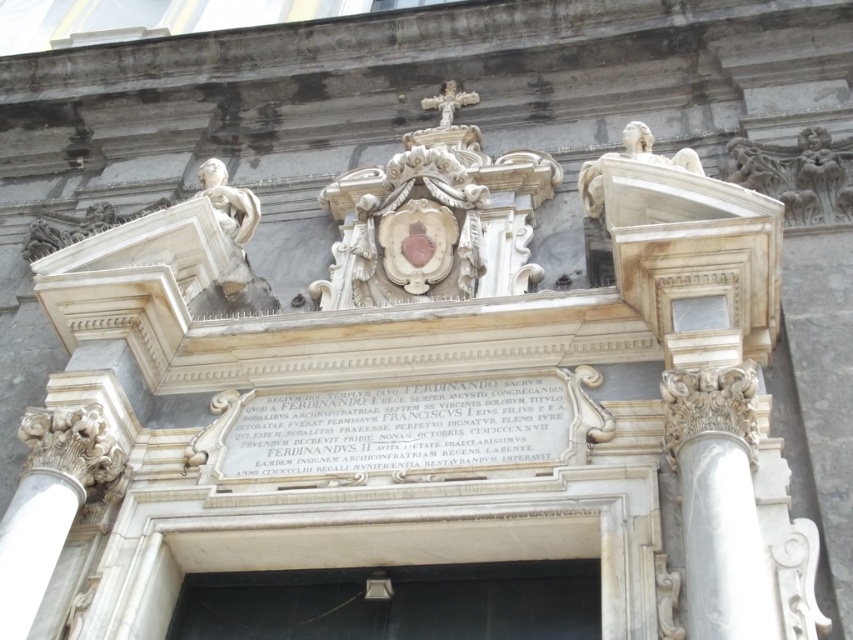
Who is taller, black matte door at center or white marble column at right?

With more height is white marble column at right.

Based on the photo, between black matte door at center and white marble column at right, which one appears on the right side from the viewer's perspective?

Positioned to the right is white marble column at right.

Is point (241, 596) positioned before point (756, 387)?

No, (241, 596) is further to viewer.

Find the location of a particular element. The image size is (853, 640). black matte door at center is located at coordinates (395, 604).

This screenshot has width=853, height=640. In order to click on white marble plaque at center in this screenshot , I will do `click(399, 428)`.

Which of these two, white marble plaque at center or white marble column at right, stands shorter?

Standing shorter between the two is white marble plaque at center.

Is point (366, 433) positioned after point (665, 442)?

Yes.

At what (x,y) coordinates should I click in order to perform the action: click on white marble plaque at center. Please return your answer as a coordinate pair (x, y). The height and width of the screenshot is (640, 853). Looking at the image, I should click on tap(399, 428).

Which of these two, black matte door at center or white marble plaque at center, stands taller?

With more height is white marble plaque at center.

Is point (378, 621) more distant than point (514, 404)?

No, it is not.

Image resolution: width=853 pixels, height=640 pixels. What are the coordinates of `black matte door at center` in the screenshot? It's located at pyautogui.click(x=395, y=604).

The image size is (853, 640). I want to click on black matte door at center, so (395, 604).